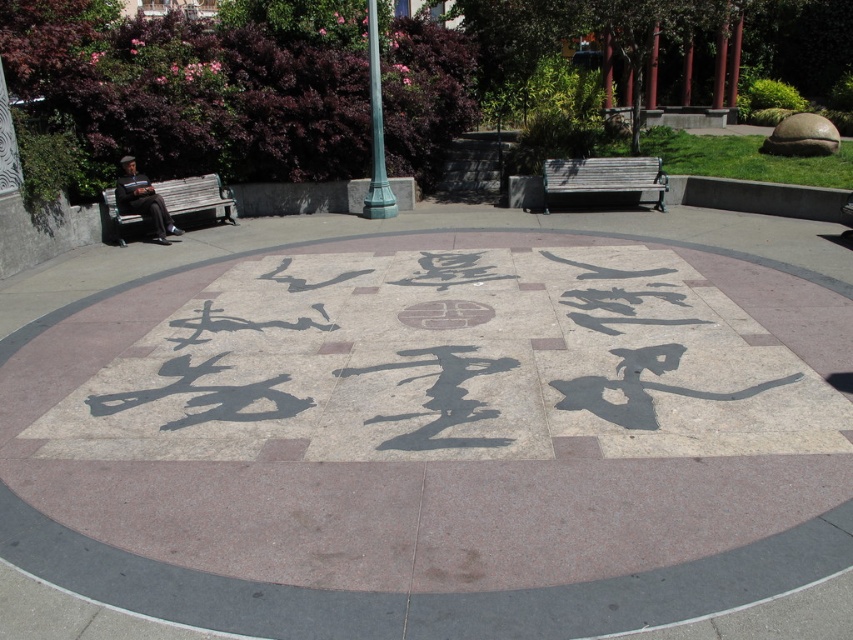
Does wooden bench at left appear under black stone circle at center?

Actually, wooden bench at left is above black stone circle at center.

Who is more forward, (111,200) or (432,301)?

Point (432,301)

You are a GUI agent. You are given a task and a screenshot of the screen. Output one action in this format:
    pyautogui.click(x=<x>, y=<y>)
    Task: Click on the wooden bench at left
    
    Given the screenshot: What is the action you would take?
    pyautogui.click(x=196, y=195)

You are a GUI agent. You are given a task and a screenshot of the screen. Output one action in this format:
    pyautogui.click(x=<x>, y=<y>)
    Task: Click on the wooden bench at left
    The height and width of the screenshot is (640, 853).
    Given the screenshot: What is the action you would take?
    pyautogui.click(x=196, y=195)

Does wooden park bench at center have a lesser height compared to black stone circle at center?

No, wooden park bench at center is not shorter than black stone circle at center.

Looking at this image, between wooden park bench at center and black stone circle at center, which one is positioned higher?

wooden park bench at center is above.

Is point (595, 163) farther from camera compared to point (444, 314)?

Yes, point (595, 163) is behind point (444, 314).

The height and width of the screenshot is (640, 853). What are the coordinates of `wooden park bench at center` in the screenshot? It's located at (604, 177).

Consider the image. Can you confirm if wooden park bench at center is positioned to the right of wooden bench at left?

Correct, you'll find wooden park bench at center to the right of wooden bench at left.

Between point (543, 168) and point (155, 182), which one is positioned in front?

Point (155, 182)

What are the coordinates of `wooden park bench at center` in the screenshot? It's located at (604, 177).